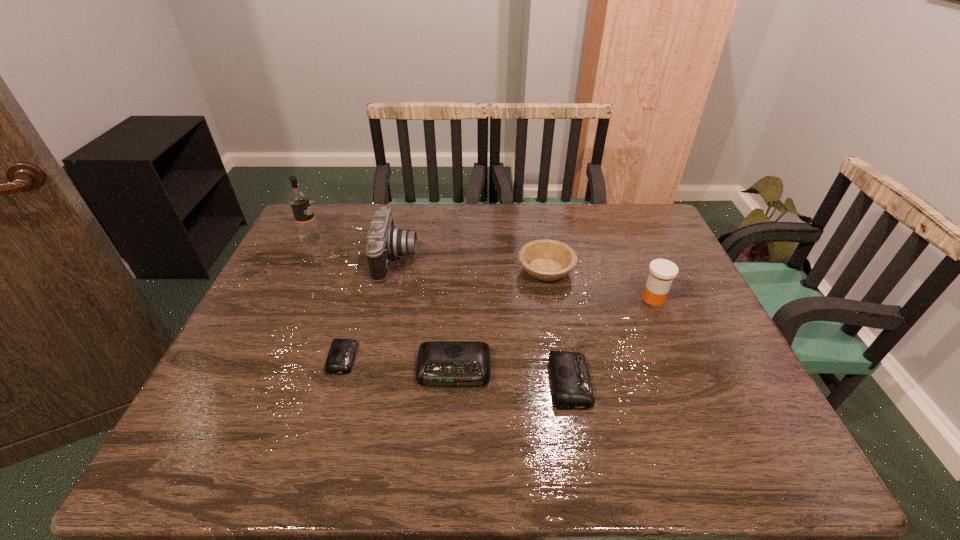
Observe the arrangement of all alarm clocks in the image. To keep them evenly spaced, where would you place another alarm clock on the right? Please locate a free space. Please provide its 2D coordinates. Your answer should be formatted as a tuple, i.e. [(x, y)], where the tuple contains the x and y coordinates of a point satisfying the conditions above.

[(693, 395)]